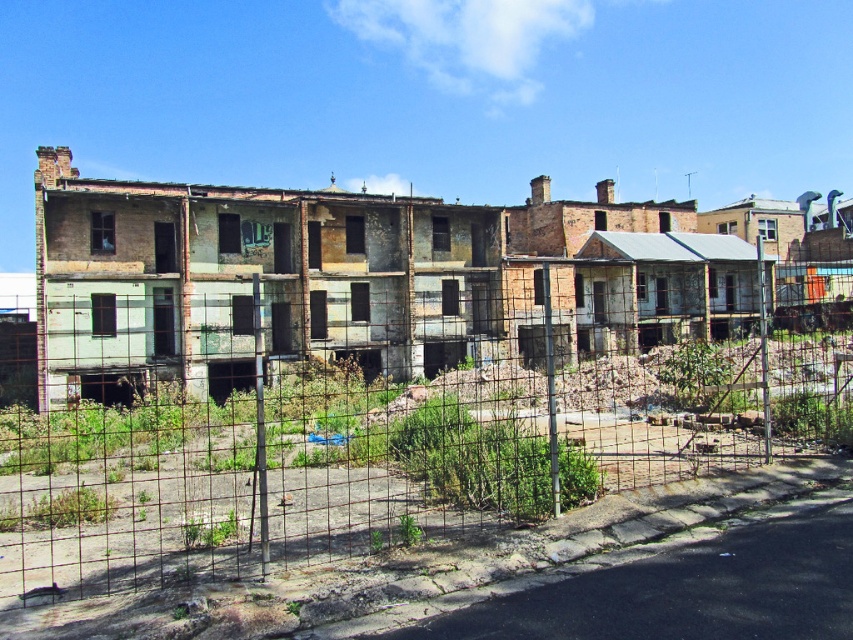
Question: Is rusty wire fence at center positioned before rusty metal building at center?

Choices:
 (A) yes
 (B) no

Answer: (A)

Question: Can you confirm if rusty wire fence at center is positioned below rusty metal building at center?

Choices:
 (A) no
 (B) yes

Answer: (B)

Question: Does rusty wire fence at center have a lesser width compared to rusty metal building at center?

Choices:
 (A) yes
 (B) no

Answer: (A)

Question: Which point is closer to the camera?

Choices:
 (A) (410, 392)
 (B) (39, 292)

Answer: (A)

Question: Which object appears farthest from the camera in this image?

Choices:
 (A) rusty wire fence at center
 (B) rusty metal building at center

Answer: (B)